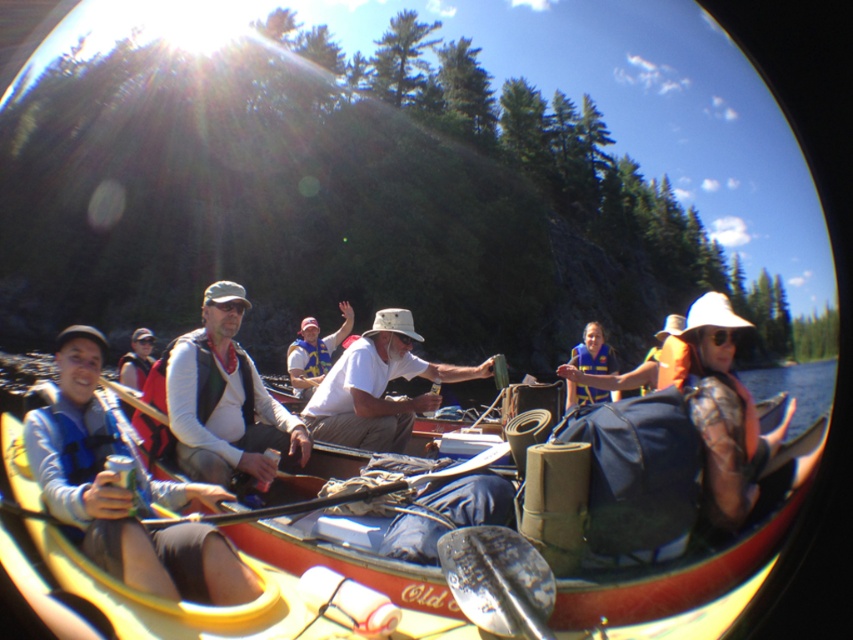
Does camouflage fabric shirt at right lie behind orange life vest at center?

No, it is in front of orange life vest at center.

Which is above, camouflage fabric shirt at right or orange life vest at center?

orange life vest at center is higher up.

Image resolution: width=853 pixels, height=640 pixels. Find the location of `camouflage fabric shirt at right`. camouflage fabric shirt at right is located at coordinates (721, 410).

You are a GUI agent. You are given a task and a screenshot of the screen. Output one action in this format:
    pyautogui.click(x=<x>, y=<y>)
    Task: Click on the camouflage fabric shirt at right
    The image size is (853, 640).
    Given the screenshot: What is the action you would take?
    coord(721,410)

Between point (242, 364) and point (714, 316), which one is positioned behind?

Positioned behind is point (242, 364).

Can you confirm if white matte vest at center is positioned below camouflage fabric shirt at right?

Actually, white matte vest at center is above camouflage fabric shirt at right.

Describe the element at coordinates (224, 397) in the screenshot. I see `white matte vest at center` at that location.

Image resolution: width=853 pixels, height=640 pixels. Identify the location of white matte vest at center. (224, 397).

Is matte blue life vest at left bigger than white cotton shirt at center?

Yes.

Between matte blue life vest at left and white cotton shirt at center, which one has less height?

Standing shorter between the two is matte blue life vest at left.

Describe the element at coordinates (119, 493) in the screenshot. I see `matte blue life vest at left` at that location.

Identify the location of matte blue life vest at left. (119, 493).